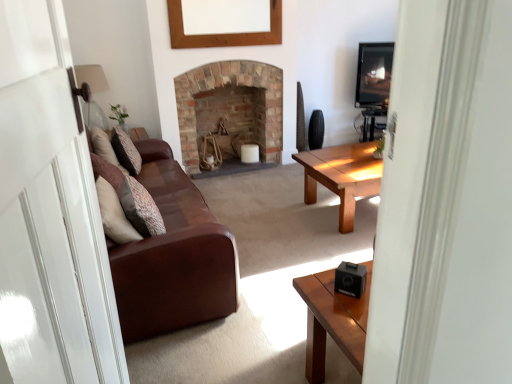
Question: Does transparent glass door at left have a greater height compared to matte glass lampshade at upper left?

Choices:
 (A) no
 (B) yes

Answer: (B)

Question: Is transparent glass door at left behind matte glass lampshade at upper left?

Choices:
 (A) yes
 (B) no

Answer: (B)

Question: From a real-world perspective, is transparent glass door at left beneath matte glass lampshade at upper left?

Choices:
 (A) no
 (B) yes

Answer: (B)

Question: Can you confirm if transparent glass door at left is positioned to the right of matte glass lampshade at upper left?

Choices:
 (A) no
 (B) yes

Answer: (B)

Question: From a real-world perspective, does transparent glass door at left stand above matte glass lampshade at upper left?

Choices:
 (A) no
 (B) yes

Answer: (A)

Question: Is patterned fabric pillow at left, which is the second pillow from bottom to top, to the left or to the right of matte glass lampshade at upper left in the image?

Choices:
 (A) left
 (B) right

Answer: (B)

Question: In the image, is patterned fabric pillow at left, placed as the second pillow when sorted from right to left, positioned in front of or behind matte glass lampshade at upper left?

Choices:
 (A) behind
 (B) front

Answer: (B)

Question: From the image's perspective, is patterned fabric pillow at left, which is the second pillow from bottom to top, located above or below matte glass lampshade at upper left?

Choices:
 (A) above
 (B) below

Answer: (B)

Question: Does point (133, 160) appear closer or farther from the camera than point (83, 115)?

Choices:
 (A) closer
 (B) farther

Answer: (A)

Question: Relative to black plastic speaker at lower right, is brown leather couch at left in front or behind?

Choices:
 (A) behind
 (B) front

Answer: (A)

Question: Considering the positions of brown leather couch at left and black plastic speaker at lower right in the image, is brown leather couch at left bigger or smaller than black plastic speaker at lower right?

Choices:
 (A) big
 (B) small

Answer: (A)

Question: Considering the positions of point (109, 253) and point (353, 284), is point (109, 253) closer or farther from the camera than point (353, 284)?

Choices:
 (A) farther
 (B) closer

Answer: (A)

Question: Which is correct: brown leather couch at left is inside black plastic speaker at lower right, or outside of it?

Choices:
 (A) inside
 (B) outside

Answer: (B)

Question: Is matte glass lampshade at upper left taller or shorter than black plastic speaker at lower right?

Choices:
 (A) tall
 (B) short

Answer: (A)

Question: From the image's perspective, relative to black plastic speaker at lower right, is matte glass lampshade at upper left above or below?

Choices:
 (A) below
 (B) above

Answer: (B)